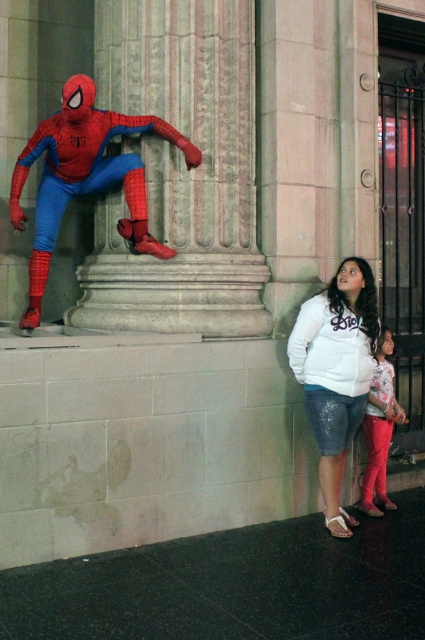
Who is more distant from viewer, (x=308, y=404) or (x=385, y=364)?

The point (x=385, y=364) is behind.

Who is more distant from viewer, (x=300, y=346) or (x=384, y=497)?

Point (x=384, y=497)

The image size is (425, 640). What are the coordinates of `white sequined shorts at lower right` in the screenshot? It's located at (337, 372).

From the picture: Is shiny spandex suit at center bigger than white sequined shorts at lower right?

Yes.

Who is higher up, shiny spandex suit at center or white sequined shorts at lower right?

shiny spandex suit at center is above.

Identify the location of shiny spandex suit at center. This screenshot has height=640, width=425. (85, 177).

Locate an element on the screen. The height and width of the screenshot is (640, 425). shiny spandex suit at center is located at coordinates (85, 177).

Between point (45, 156) and point (367, 497), which one is positioned in front?

Point (45, 156)

Based on the photo, is shiny spandex suit at center wider than glittery leggings at lower right?

Yes, shiny spandex suit at center is wider than glittery leggings at lower right.

Between point (14, 186) and point (385, 413), which one is positioned in front?

Point (14, 186) is in front.

I want to click on shiny spandex suit at center, so point(85,177).